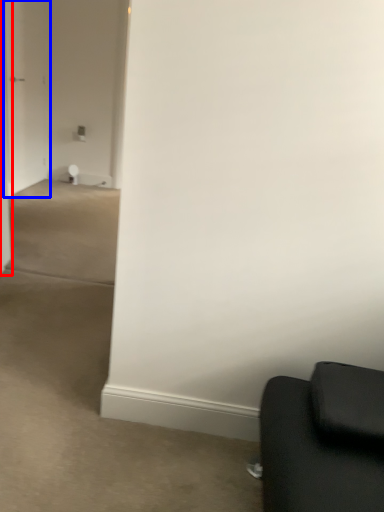
Question: Among these objects, which one is nearest to the camera, door (highlighted by a red box) or glass door (highlighted by a blue box)?

Choices:
 (A) door
 (B) glass door

Answer: (A)